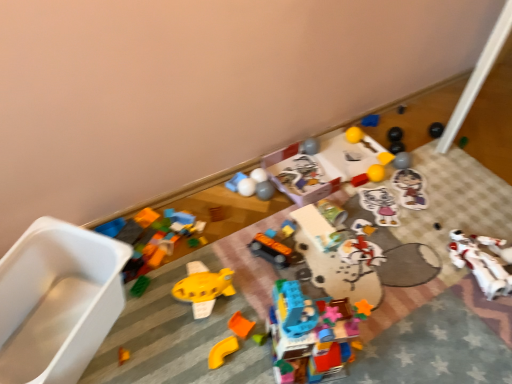
The width and height of the screenshot is (512, 384). What are the coordinates of `free space that is in between matte plastic sticker at center, which is the second toy in right-to-left order, and white plastic container at left, which is counted as the first toy, starting from the left` in the screenshot? It's located at (266, 271).